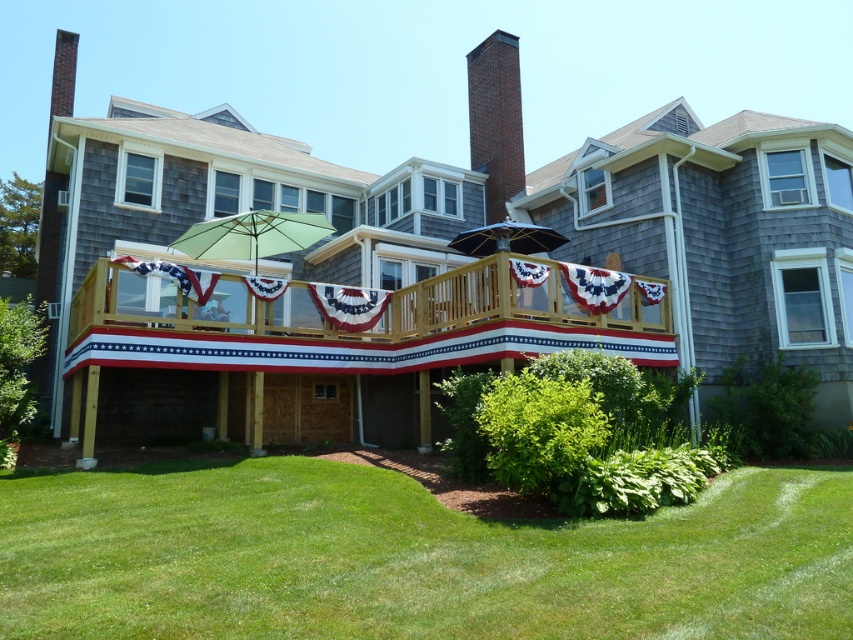
In the scene shown: Can you confirm if brick chimney at center is thinner than yellow fabric umbrella at center?

Indeed, brick chimney at center has a lesser width compared to yellow fabric umbrella at center.

In the scene shown: Is brick chimney at center in front of yellow fabric umbrella at center?

No, brick chimney at center is behind yellow fabric umbrella at center.

I want to click on brick chimney at center, so click(495, 120).

What do you see at coordinates (252, 236) in the screenshot? The width and height of the screenshot is (853, 640). I see `green fabric umbrella at center` at bounding box center [252, 236].

Between green fabric umbrella at center and yellow fabric umbrella at center, which one appears on the right side from the viewer's perspective?

yellow fabric umbrella at center

This screenshot has height=640, width=853. Find the location of `green fabric umbrella at center`. green fabric umbrella at center is located at coordinates (252, 236).

Which is more to the left, green grass at lower center or wooden deck at center?

wooden deck at center

Consider the image. Which is more to the right, green grass at lower center or wooden deck at center?

green grass at lower center

Image resolution: width=853 pixels, height=640 pixels. Find the location of `green grass at lower center`. green grass at lower center is located at coordinates (410, 557).